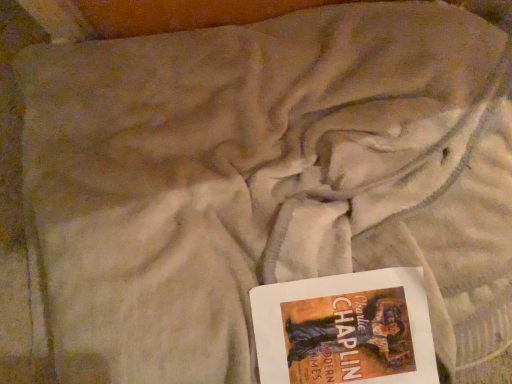
Describe the element at coordinates (345, 329) in the screenshot. The width and height of the screenshot is (512, 384). I see `white paper book at lower right` at that location.

The width and height of the screenshot is (512, 384). Identify the location of white paper book at lower right. (345, 329).

You are a GUI agent. You are given a task and a screenshot of the screen. Output one action in this format:
    pyautogui.click(x=<x>, y=<y>)
    Task: Click on the white paper book at lower right
    This screenshot has height=384, width=512.
    Given the screenshot: What is the action you would take?
    pyautogui.click(x=345, y=329)